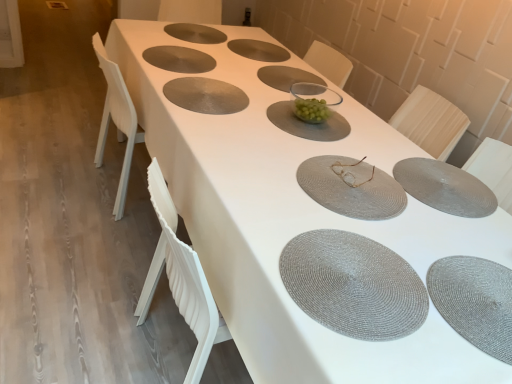
Find the location of a particular element. The width and height of the screenshot is (512, 384). vacant space in between gray woven placemat at center, the 2th tableware in the bottom-to-top sequence, and clear glass bowl at center, arranged as the 6th tableware when ordered from the bottom is located at coordinates (358, 137).